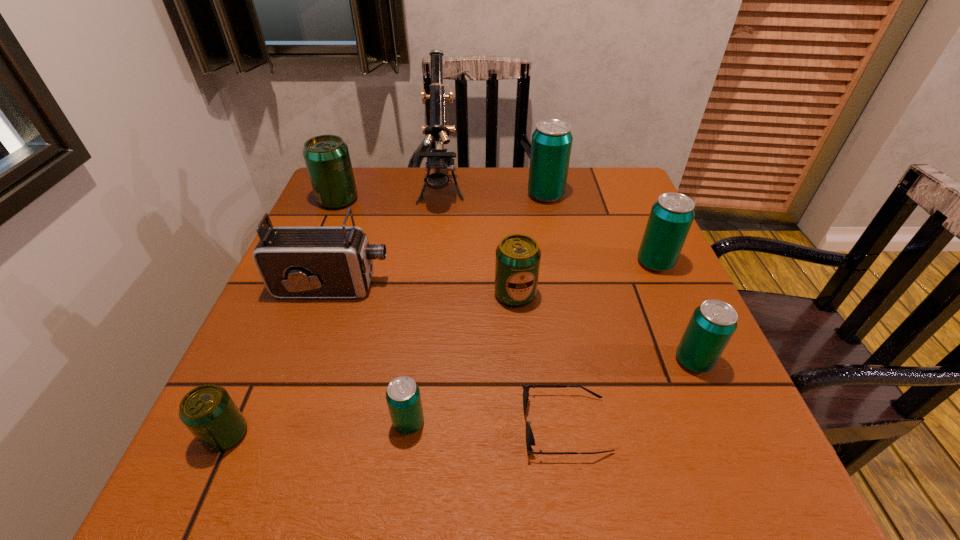
This screenshot has height=540, width=960. Identify the location of beer can that is the closest to the camcorder. (517, 262).

Choose which teal beer can is the third nearest neighbor to the second farthest teal beer can. Please provide its 2D coordinates. Your answer should be formatted as a tuple, i.e. [(x, y)], where the tuple contains the x and y coordinates of a point satisfying the conditions above.

[(403, 398)]

Locate which teal beer can ranks fourth in proximity to the second biggest green beer can. Please provide its 2D coordinates. Your answer should be formatted as a tuple, i.e. [(x, y)], where the tuple contains the x and y coordinates of a point satisfying the conditions above.

[(551, 145)]

Locate which green beer can is the second closest to the microscope. Please provide its 2D coordinates. Your answer should be formatted as a tuple, i.e. [(x, y)], where the tuple contains the x and y coordinates of a point satisfying the conditions above.

[(517, 262)]

Identify which green beer can is the third nearest to the sunglasses. Please provide its 2D coordinates. Your answer should be formatted as a tuple, i.e. [(x, y)], where the tuple contains the x and y coordinates of a point satisfying the conditions above.

[(327, 159)]

You are a GUI agent. You are given a task and a screenshot of the screen. Output one action in this format:
    pyautogui.click(x=<x>, y=<y>)
    Task: Click on the free point that satisfies the following two spatial constraints: 1. through the eyepiece of the tallest object; 2. on the right side of the biggest teal beer can
    
    Given the screenshot: What is the action you would take?
    pyautogui.click(x=441, y=195)

Where is `free spot that satisfies the following two spatial constraints: 1. at the lens of the seventh farthest object; 2. on the right side of the camcorder`? The image size is (960, 540). free spot that satisfies the following two spatial constraints: 1. at the lens of the seventh farthest object; 2. on the right side of the camcorder is located at coordinates (306, 361).

Identify the location of free space that satisfies the following two spatial constraints: 1. on the back side of the third teal beer can from right to left; 2. on the right side of the nearest teal beer can. (438, 195).

Where is `vacant region that satisfies the following two spatial constraints: 1. through the eyepiece of the microscope; 2. on the right side of the second nearest teal beer can`? Image resolution: width=960 pixels, height=540 pixels. vacant region that satisfies the following two spatial constraints: 1. through the eyepiece of the microscope; 2. on the right side of the second nearest teal beer can is located at coordinates (421, 361).

Identify the location of free spot that satisfies the following two spatial constraints: 1. on the front side of the second nearest teal beer can; 2. on the left side of the third beer can from right to left. (579, 361).